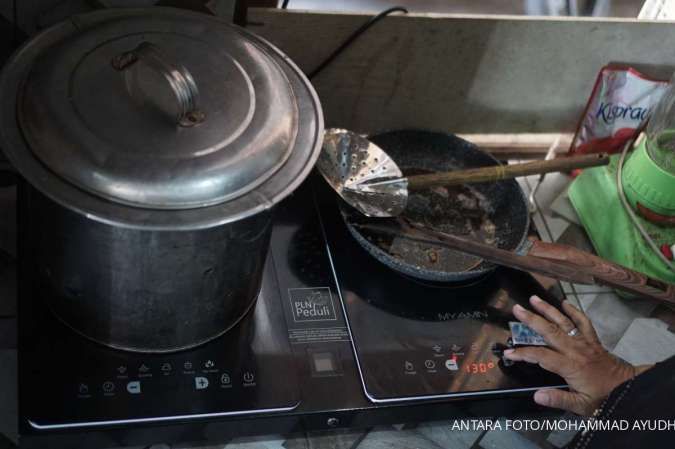
Locate an element on the screen. The height and width of the screenshot is (449, 675). handle is located at coordinates (178, 79), (626, 276).